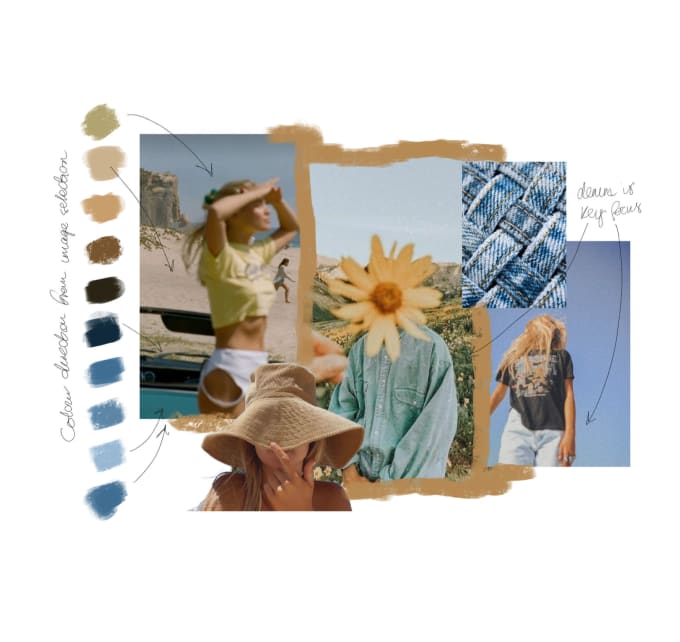
Image resolution: width=680 pixels, height=642 pixels. I want to click on color swatches, so click(101, 122), click(102, 162), click(102, 209), click(99, 250), click(103, 291), click(102, 331), click(105, 369), click(103, 413), click(102, 452), click(105, 504).